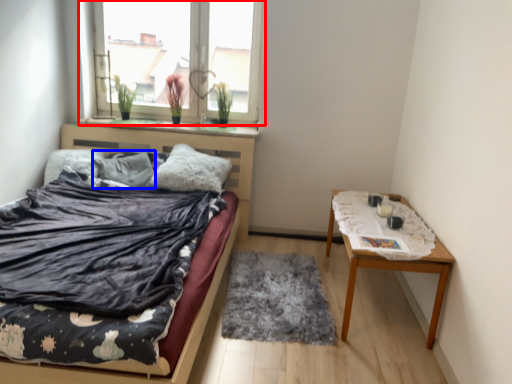
Question: Among these objects, which one is nearest to the camera, window (highlighted by a red box) or pillow (highlighted by a blue box)?

Choices:
 (A) window
 (B) pillow

Answer: (B)